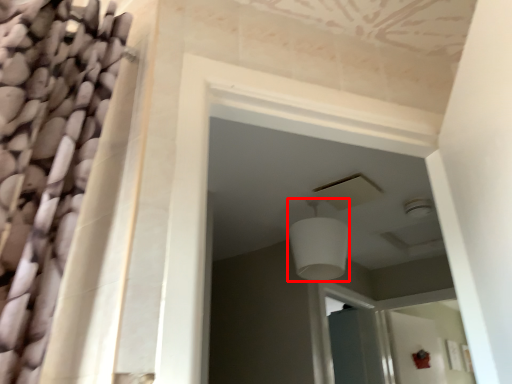
Question: Where is light fixture (annotated by the red box) located in relation to screen door in the image?

Choices:
 (A) left
 (B) right

Answer: (A)